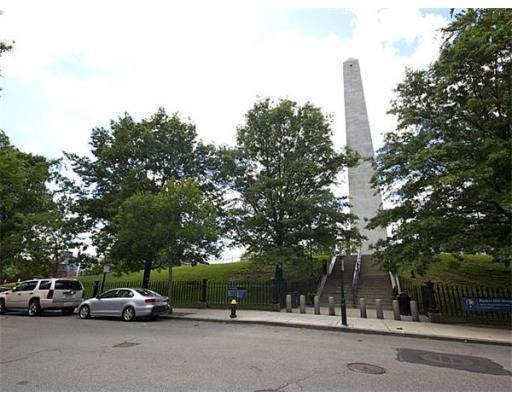
Where is `stairs`? stairs is located at coordinates (371, 279), (330, 283).